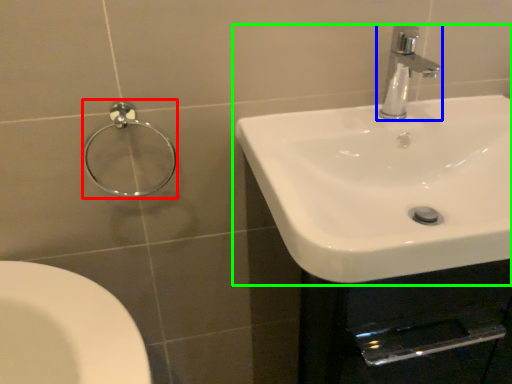
Question: Which is farther away from shower (highlighted by a red box)? tap (highlighted by a blue box) or sink (highlighted by a green box)?

Choices:
 (A) tap
 (B) sink

Answer: (A)